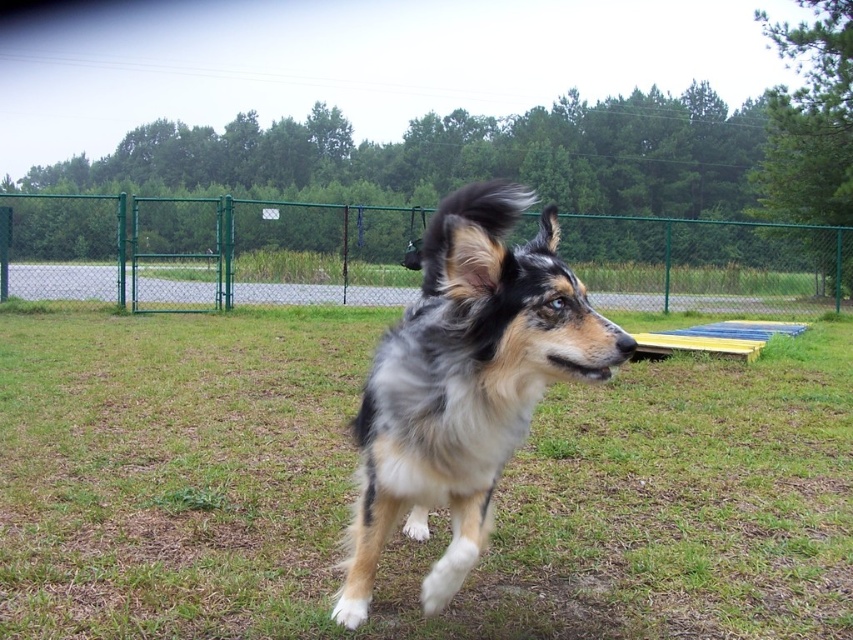
Question: Which point appears closest to the camera in this image?

Choices:
 (A) (279, 209)
 (B) (550, 212)
 (C) (186, 589)

Answer: (B)

Question: Estimate the real-world distances between objects in this image. Which object is farther from the shaggy fur dog at center?

Choices:
 (A) fuzzy fur dog at center
 (B) green chain-link fence at center

Answer: (B)

Question: Is green chain-link fence at center positioned at the back of shaggy fur dog at center?

Choices:
 (A) no
 (B) yes

Answer: (B)

Question: Does green chain-link fence at center appear over shaggy fur dog at center?

Choices:
 (A) yes
 (B) no

Answer: (A)

Question: Which point appears farthest from the camera in this image?

Choices:
 (A) (445, 321)
 (B) (604, 529)
 (C) (18, 294)

Answer: (C)

Question: Does fuzzy fur dog at center appear under shaggy fur dog at center?

Choices:
 (A) no
 (B) yes

Answer: (B)